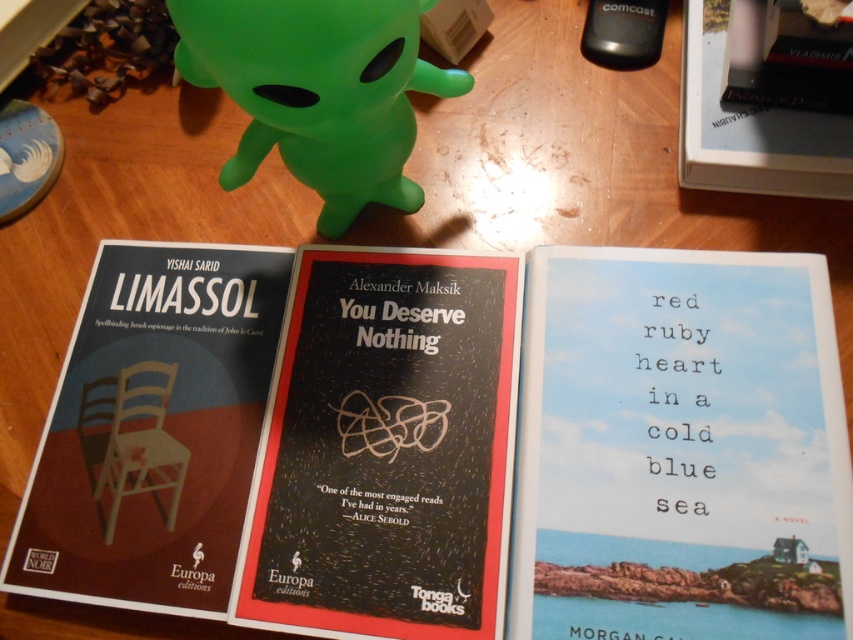
In the scene shown: What is the 2D coordinate of the matte black chair at center left?

The matte black chair at center left is located at point (152,429).

You are a photographer trying to capture the matte black chair at center left and the green rubber toy at upper center in the same frame. Which object should you focus on first to ensure both are in the frame?

The matte black chair at center left is located below the green rubber toy at upper center, so you should focus on the green rubber toy at upper center first to ensure both are in the frame.